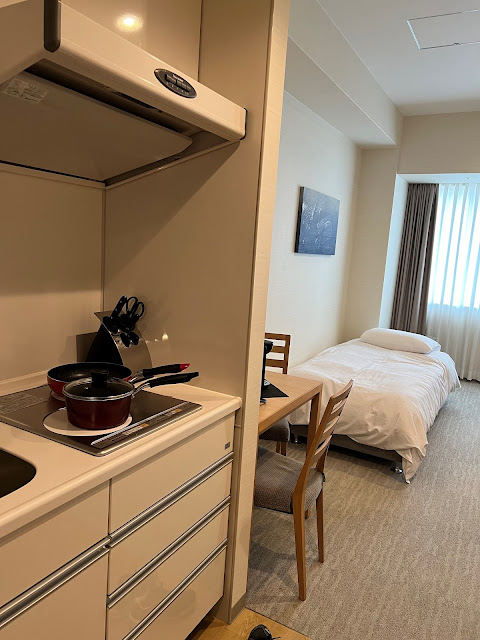
In order to click on pot in this screenshot , I will do `click(98, 411)`.